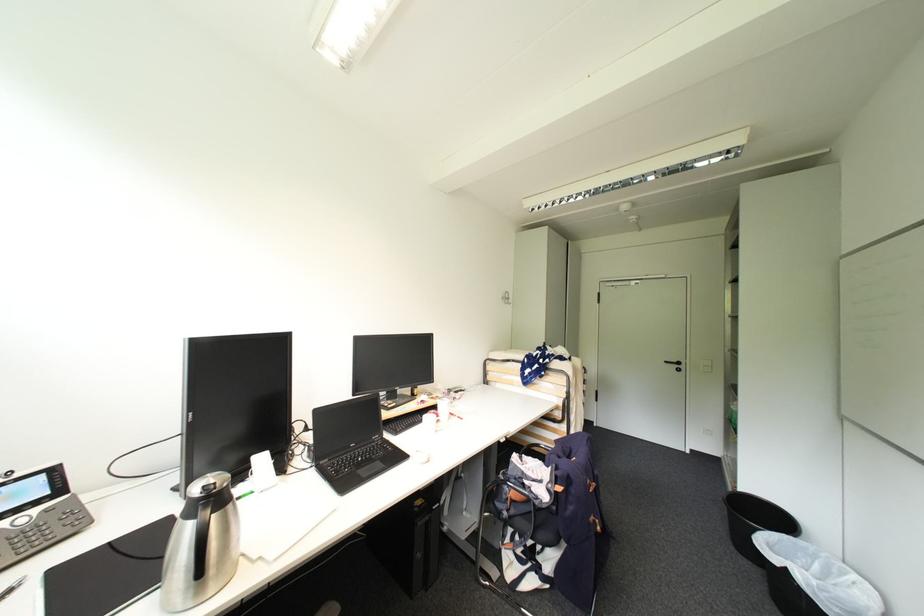
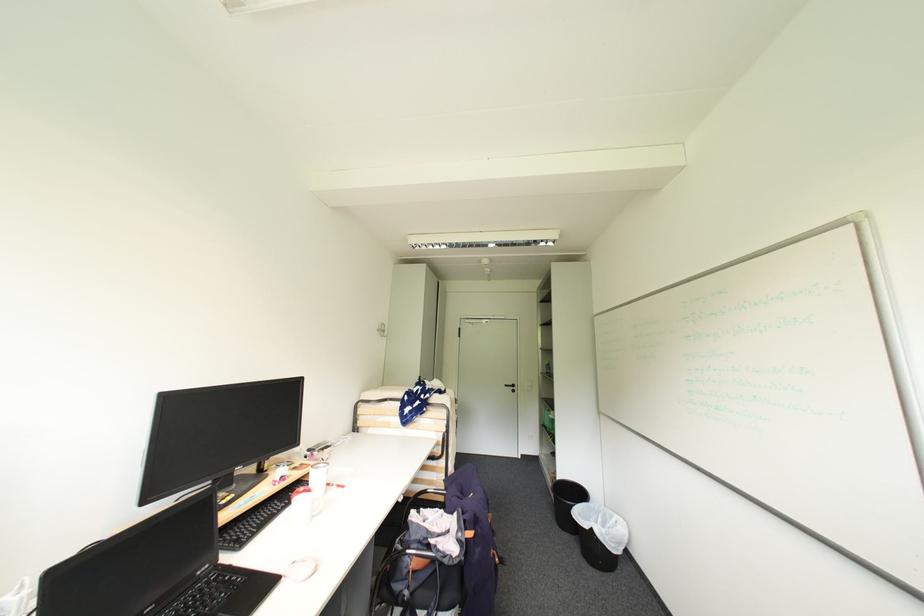
Question: The images are taken continuously from a first-person perspective. In which direction is your viewpoint rotating?

Choices:
 (A) Left
 (B) Right
 (C) Up
 (D) Down

Answer: (B)